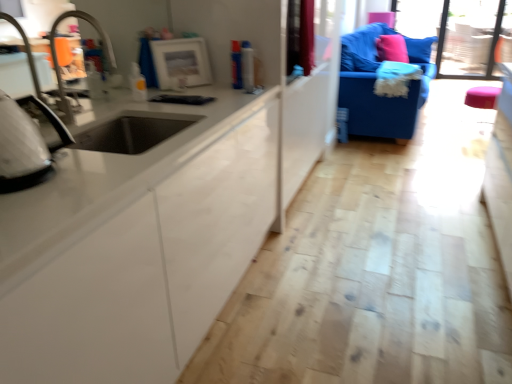
Question: Is white glossy iron at left, which ranks as the 2th appliance in top-to-bottom order, in contact with transparent glass window screen at upper right?

Choices:
 (A) yes
 (B) no

Answer: (B)

Question: From the image's perspective, is white glossy iron at left, the first appliance from the left, beneath transparent glass window screen at upper right?

Choices:
 (A) no
 (B) yes

Answer: (B)

Question: Is white glossy iron at left, which is the first appliance from front to back, aimed at transparent glass window screen at upper right?

Choices:
 (A) no
 (B) yes

Answer: (A)

Question: Is white glossy iron at left, the 2th appliance in the right-to-left sequence, looking in the opposite direction of transparent glass window screen at upper right?

Choices:
 (A) no
 (B) yes

Answer: (A)

Question: Does white glossy iron at left, the first appliance from the left, appear on the right side of transparent glass window screen at upper right?

Choices:
 (A) yes
 (B) no

Answer: (B)

Question: Would you say matte white frame at upper center, placed as the second appliance when sorted from left to right, is to the left or to the right of white glossy iron at left, the 1th appliance positioned from the bottom, in the picture?

Choices:
 (A) left
 (B) right

Answer: (B)

Question: From a real-world perspective, is matte white frame at upper center, the first appliance from the back, positioned above or below white glossy iron at left, the 1th appliance positioned from the bottom?

Choices:
 (A) above
 (B) below

Answer: (B)

Question: Is matte white frame at upper center, which ranks as the 2th appliance in front-to-back order, wider or thinner than white glossy iron at left, the 2th appliance in the back-to-front sequence?

Choices:
 (A) thin
 (B) wide

Answer: (A)

Question: From their relative heights in the image, would you say matte white frame at upper center, arranged as the 1th appliance when viewed from the top, is taller or shorter than white glossy iron at left, the 1th appliance positioned from the bottom?

Choices:
 (A) short
 (B) tall

Answer: (B)

Question: From the image's perspective, is matte white frame at upper center, the 2th appliance from the bottom, positioned above or below brushed metal faucet at left?

Choices:
 (A) above
 (B) below

Answer: (A)

Question: Is point (173, 76) closer or farther from the camera than point (60, 91)?

Choices:
 (A) farther
 (B) closer

Answer: (A)

Question: From their relative heights in the image, would you say matte white frame at upper center, placed as the second appliance when sorted from left to right, is taller or shorter than brushed metal faucet at left?

Choices:
 (A) tall
 (B) short

Answer: (B)

Question: Relative to brushed metal faucet at left, is matte white frame at upper center, arranged as the 1th appliance when viewed from the top, in front or behind?

Choices:
 (A) front
 (B) behind

Answer: (B)

Question: Is matte white frame at upper center, which ranks as the 2th appliance in front-to-back order, taller or shorter than pink fabric pillow at upper right?

Choices:
 (A) short
 (B) tall

Answer: (A)

Question: From the image's perspective, is matte white frame at upper center, which ranks as the 2th appliance in front-to-back order, above or below pink fabric pillow at upper right?

Choices:
 (A) below
 (B) above

Answer: (A)